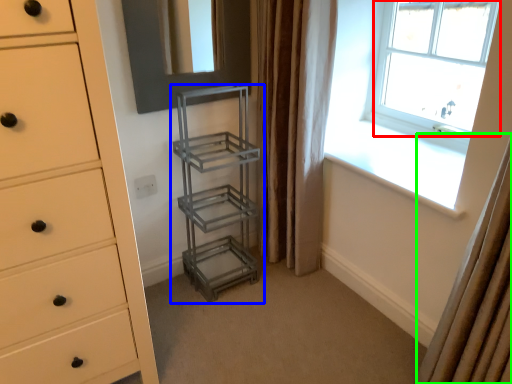
Question: Which object is the closest to the window (highlighted by a red box)? Choose among these: shelf (highlighted by a blue box) or curtain (highlighted by a green box).

Choices:
 (A) shelf
 (B) curtain

Answer: (A)